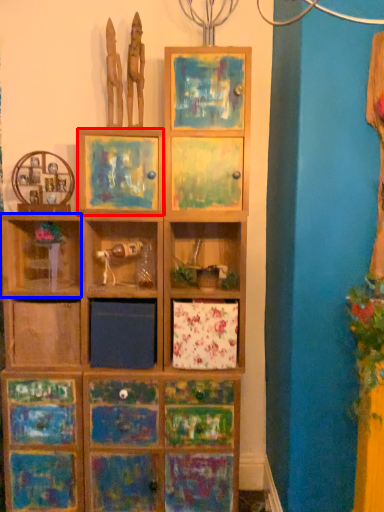
Question: Which object appears closest to the camera in this image, picture frame (highlighted by a red box) or shelf (highlighted by a blue box)?

Choices:
 (A) picture frame
 (B) shelf

Answer: (A)